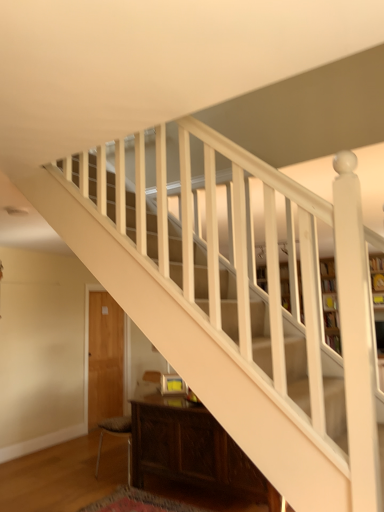
Question: Is dark brown leather armchair at lower left oriented towards white wood bookcase at center?

Choices:
 (A) no
 (B) yes

Answer: (A)

Question: Can we say dark brown leather armchair at lower left lies outside white wood bookcase at center?

Choices:
 (A) yes
 (B) no

Answer: (A)

Question: Is dark brown leather armchair at lower left closer to camera compared to white wood bookcase at center?

Choices:
 (A) no
 (B) yes

Answer: (B)

Question: From the image's perspective, is dark brown leather armchair at lower left located above white wood bookcase at center?

Choices:
 (A) no
 (B) yes

Answer: (A)

Question: Is dark brown leather armchair at lower left looking in the opposite direction of white wood bookcase at center?

Choices:
 (A) no
 (B) yes

Answer: (B)

Question: Are dark brown leather armchair at lower left and white wood bookcase at center far apart?

Choices:
 (A) yes
 (B) no

Answer: (A)

Question: From a real-world perspective, is dark wood cabinet at lower center below dark brown leather armchair at lower left?

Choices:
 (A) yes
 (B) no

Answer: (A)

Question: Is dark wood cabinet at lower center positioned with its back to dark brown leather armchair at lower left?

Choices:
 (A) no
 (B) yes

Answer: (A)

Question: From the image's perspective, is dark wood cabinet at lower center above dark brown leather armchair at lower left?

Choices:
 (A) yes
 (B) no

Answer: (A)

Question: Considering the relative sizes of dark wood cabinet at lower center and dark brown leather armchair at lower left in the image provided, is dark wood cabinet at lower center bigger than dark brown leather armchair at lower left?

Choices:
 (A) yes
 (B) no

Answer: (A)

Question: Considering the relative positions of dark wood cabinet at lower center and dark brown leather armchair at lower left in the image provided, is dark wood cabinet at lower center behind dark brown leather armchair at lower left?

Choices:
 (A) yes
 (B) no

Answer: (B)

Question: Can you see dark wood cabinet at lower center touching dark brown leather armchair at lower left?

Choices:
 (A) no
 (B) yes

Answer: (A)

Question: Is dark wood cabinet at lower center to the left of white wood bookcase at center from the viewer's perspective?

Choices:
 (A) yes
 (B) no

Answer: (A)